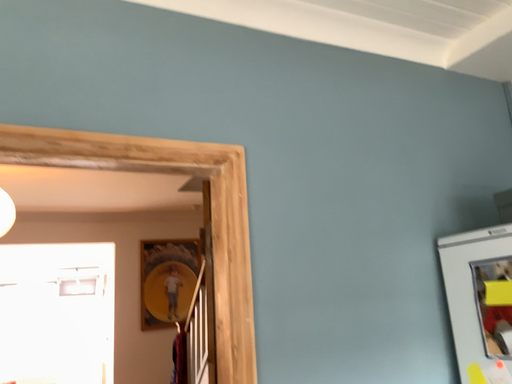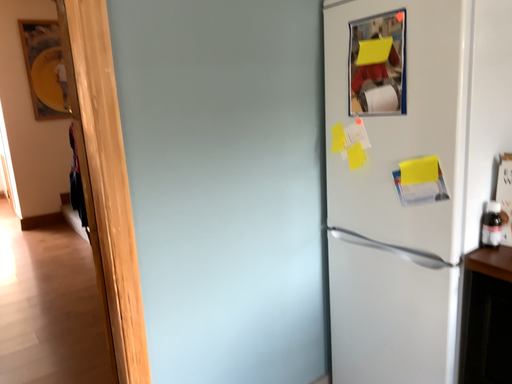
Question: Which way did the camera rotate in the video?

Choices:
 (A) rotated downward
 (B) rotated upward

Answer: (A)